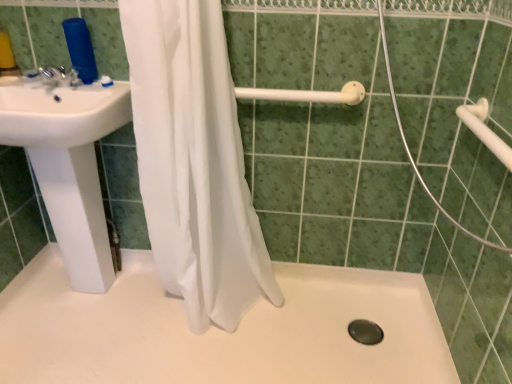
I want to click on vacant space in front of white sheer curtain at center, so click(207, 360).